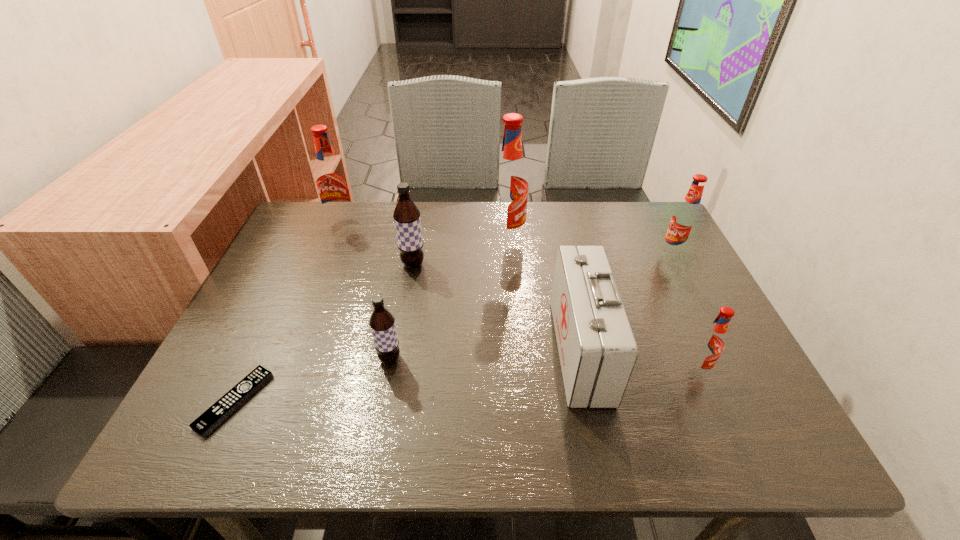
Select which red root beer appears as the third closest to the leftmost red root beer. Please provide its 2D coordinates. Your answer should be formatted as a tuple, i.e. [(x, y)], where the tuple contains the x and y coordinates of a point satisfying the conditions above.

[(710, 344)]

Identify the location of vacant space that satisfies the following two spatial constraints: 1. on the back side of the second object from right to left; 2. on the front-facing side of the red first-aid kit. The height and width of the screenshot is (540, 960). (688, 350).

Identify the location of free space that satisfies the following two spatial constraints: 1. on the front-facing side of the first-aid kit; 2. on the front side of the shortest object. (591, 401).